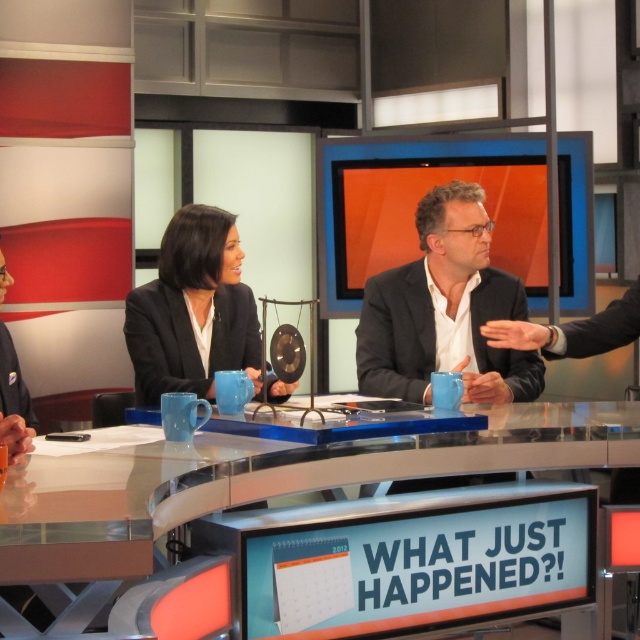
You are a guest entering the studio and need to sit down. The clear glass table at center is in your path. Where is the dark gray fabric business suit at left relative to the table?

The dark gray fabric business suit at left is positioned above the clear glass table at center.

You are a guest entering the studio and need to sit down. The clear glass table at center and the black matte business suit at center are in your line of sight. Which object is bigger in size?

The clear glass table at center has a larger size compared to the black matte business suit at center, so the clear glass table at center is bigger.

You are a camera operator in a TV studio. You need to adjust the camera to focus on the clear glass table at center. The camera has a minimum focus distance of 1.5 meters. Can the camera focus on the table from its current position?

The clear glass table at center and camera are 1.40 meters apart. Since the minimum focus distance is 1.5 meters, the camera cannot focus on the table from its current position because it is too close.